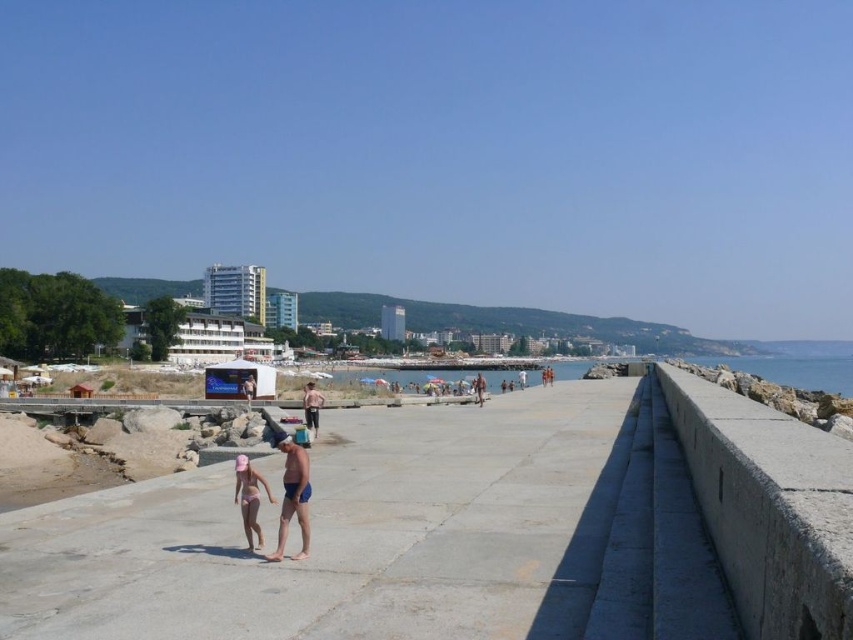
Can you confirm if pink matte swimsuit at center is positioned above smooth tan skin at center?

Yes, pink matte swimsuit at center is above smooth tan skin at center.

Between pink matte swimsuit at center and smooth tan skin at center, which one has more height?

With more height is smooth tan skin at center.

Does point (241, 477) lie behind point (306, 384)?

That is False.

Locate an element on the screen. Image resolution: width=853 pixels, height=640 pixels. pink matte swimsuit at center is located at coordinates (248, 499).

Measure the distance between blue matte shorts at center and pink matte swimsuit at center.

blue matte shorts at center and pink matte swimsuit at center are 5.14 feet apart from each other.

Is blue matte shorts at center further to camera compared to pink matte swimsuit at center?

No, blue matte shorts at center is closer to the viewer.

Does point (299, 552) come behind point (248, 481)?

That is True.

At what (x,y) coordinates should I click in order to perform the action: click on blue matte shorts at center. Please return your answer as a coordinate pair (x, y). The image size is (853, 640). Looking at the image, I should click on (293, 497).

Which is above, smooth concrete pier at center or blue water at right?

smooth concrete pier at center

Is smooth concrete pier at center bigger than blue water at right?

No.

Is point (476, 460) positioned in front of point (709, 365)?

Yes, point (476, 460) is in front of point (709, 365).

This screenshot has height=640, width=853. Identify the location of smooth concrete pier at center. (474, 531).